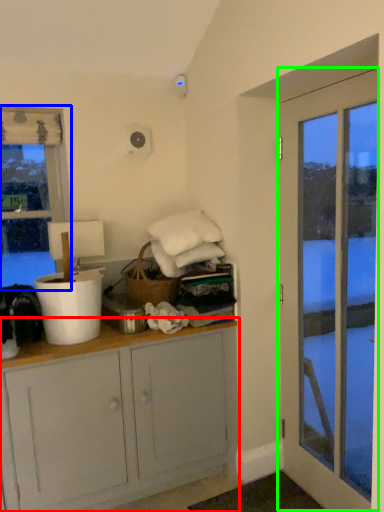
Question: Which is farther away from cabinetry (highlighted by a red box)? window (highlighted by a blue box) or door (highlighted by a green box)?

Choices:
 (A) window
 (B) door

Answer: (A)